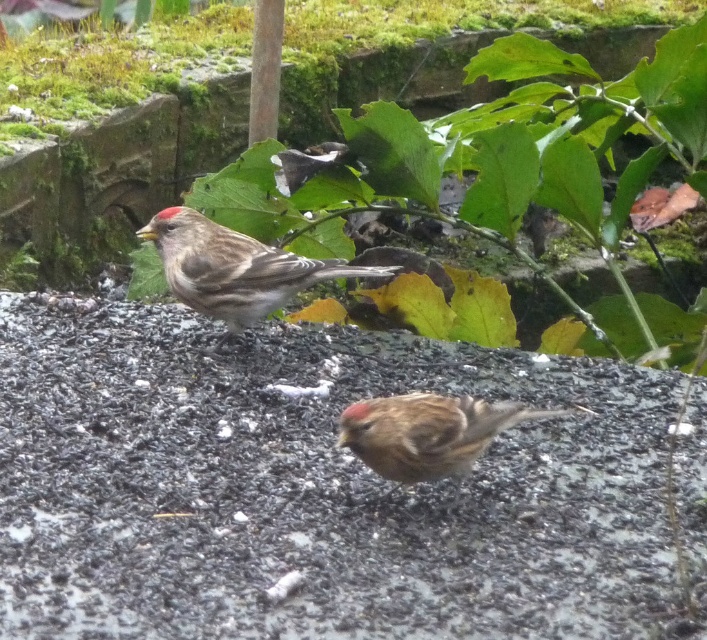
Question: Which object is the closest to the gray gravel at center?

Choices:
 (A) brown matte sparrow at upper left
 (B) brown feathered sparrow at center

Answer: (B)

Question: Which object is farther from the camera taking this photo?

Choices:
 (A) gray gravel at center
 (B) brown matte sparrow at upper left
 (C) brown feathered sparrow at center

Answer: (B)

Question: Is gray gravel at center to the left of brown matte sparrow at upper left from the viewer's perspective?

Choices:
 (A) yes
 (B) no

Answer: (A)

Question: Is gray gravel at center bigger than brown feathered sparrow at center?

Choices:
 (A) yes
 (B) no

Answer: (A)

Question: Can you confirm if gray gravel at center is positioned to the right of brown feathered sparrow at center?

Choices:
 (A) yes
 (B) no

Answer: (B)

Question: Estimate the real-world distances between objects in this image. Which object is farther from the gray gravel at center?

Choices:
 (A) brown matte sparrow at upper left
 (B) brown feathered sparrow at center

Answer: (A)